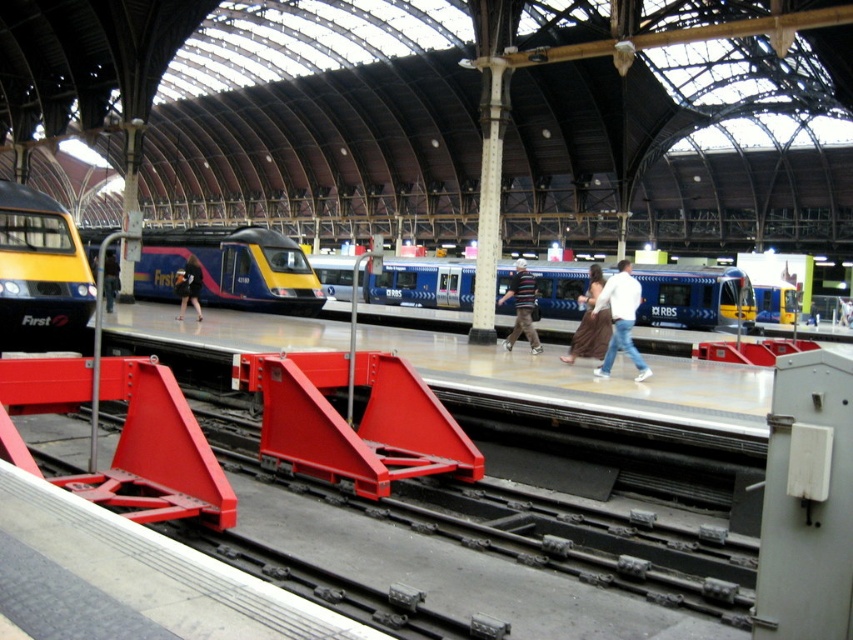
Who is shorter, yellow matte train at left or dark brown leather jacket at center?

Standing shorter between the two is dark brown leather jacket at center.

Which is in front, point (22, 218) or point (108, 272)?

Positioned in front is point (22, 218).

You are a GUI agent. You are given a task and a screenshot of the screen. Output one action in this format:
    pyautogui.click(x=<x>, y=<y>)
    Task: Click on the yellow matte train at left
    The height and width of the screenshot is (640, 853).
    Given the screenshot: What is the action you would take?
    pyautogui.click(x=39, y=273)

Which is in front, point (422, 262) or point (508, 349)?

Point (508, 349) is more forward.

Does blue metallic train at center appear under striped sweater at center?

Actually, blue metallic train at center is above striped sweater at center.

Describe the element at coordinates (709, 298) in the screenshot. I see `blue metallic train at center` at that location.

Where is `blue metallic train at center`? blue metallic train at center is located at coordinates (709, 298).

Is metallic red platform at center taller than dark brown leather jacket at center?

No.

Who is higher up, metallic red platform at center or dark brown leather jacket at center?

dark brown leather jacket at center

Does point (526, 358) come closer to viewer compared to point (106, 257)?

Yes, point (526, 358) is in front of point (106, 257).

Locate an element on the screen. This screenshot has width=853, height=640. metallic red platform at center is located at coordinates (589, 380).